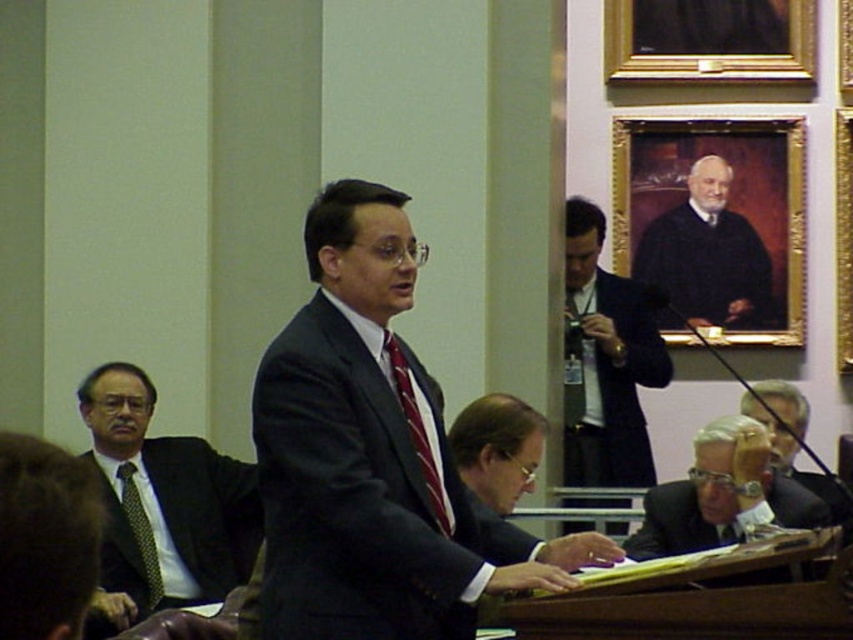
Consider the image. You are a stagehand needing to place a 10 feet long banner between the black matte suit at lower right and the striped silk tie at center. Can you fit it there?

The distance between the black matte suit at lower right and the striped silk tie at center is 8.79 feet, which is shorter than the banner length of 10 feet. The banner cannot be placed there.

You are an observer in the courtroom. You see the matte black suit at center and the black matte suit at lower right. Which one is positioned higher in the image?

The matte black suit at center is positioned higher in the image than the black matte suit at lower right.